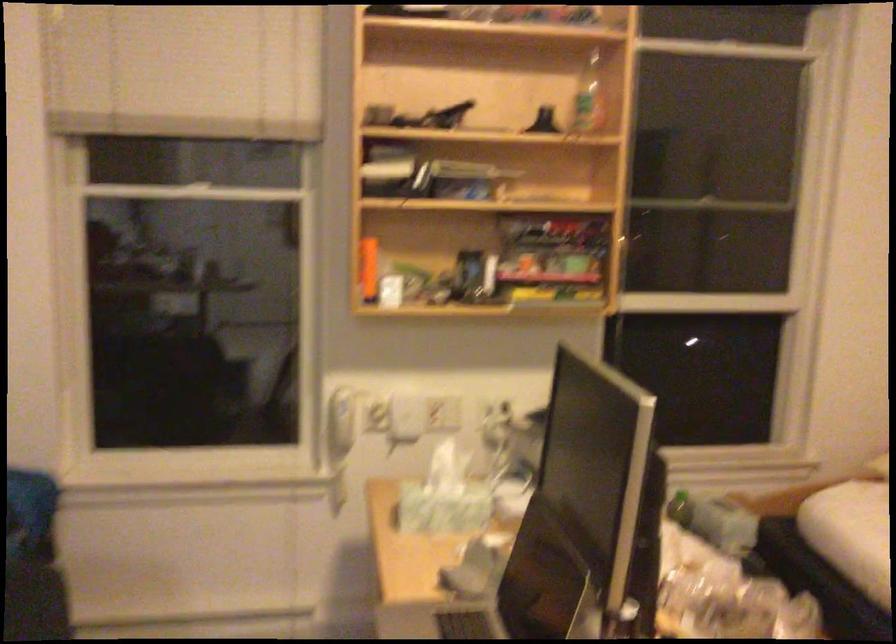
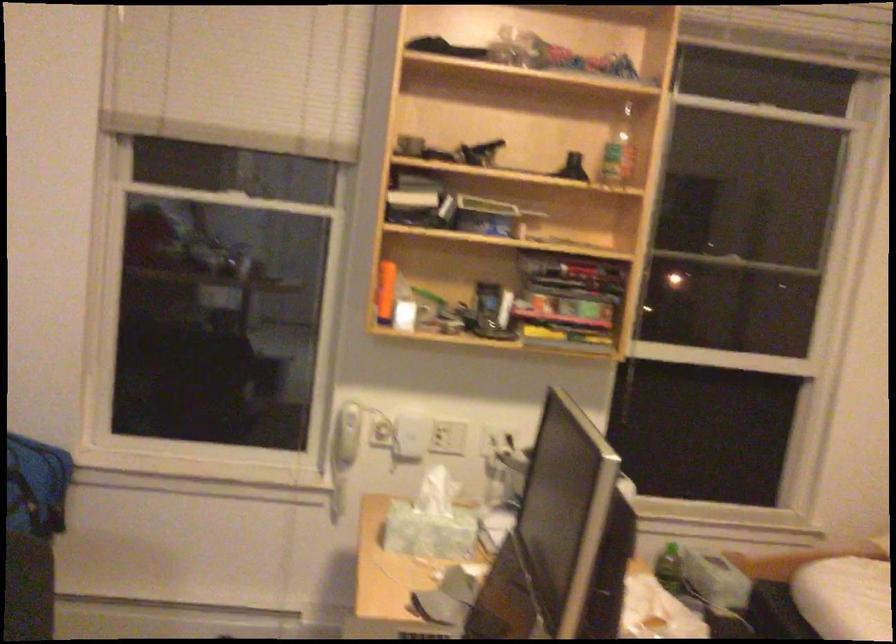
The point at (590,107) is marked in the first image. Where is the corresponding point in the second image?

(617, 151)